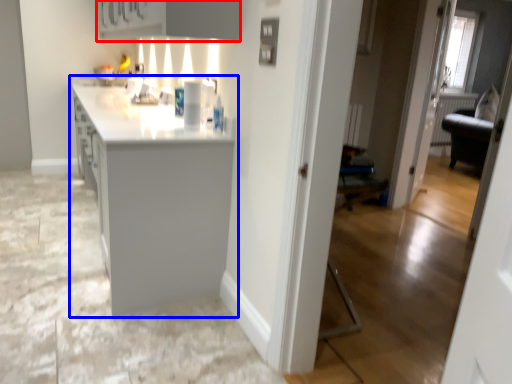
Question: Which point is closer to the camera, cabinetry (highlighted by a red box) or countertop (highlighted by a blue box)?

Choices:
 (A) cabinetry
 (B) countertop

Answer: (A)